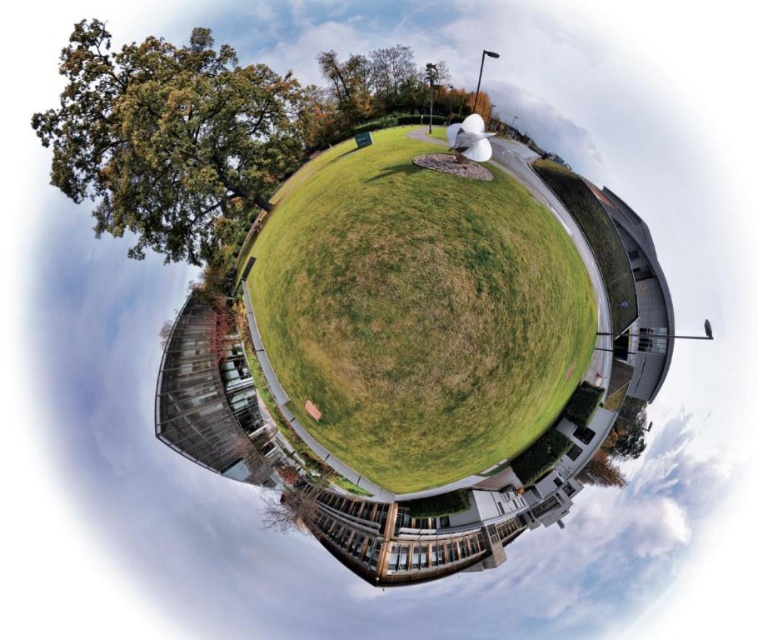
You are standing at the center of the spherical panorama image. You want to walk towards the green grassy at center. In which direction should you move relative to the image?

Since the green grassy at center is located at point (418, 314) in the image, you should move towards the center of the image to reach it.

You are standing in the park and looking around. Which object is closer to you, the green grassy at center or the green leafy tree at upper left?

The green grassy at center is closer to you than the green leafy tree at upper left.